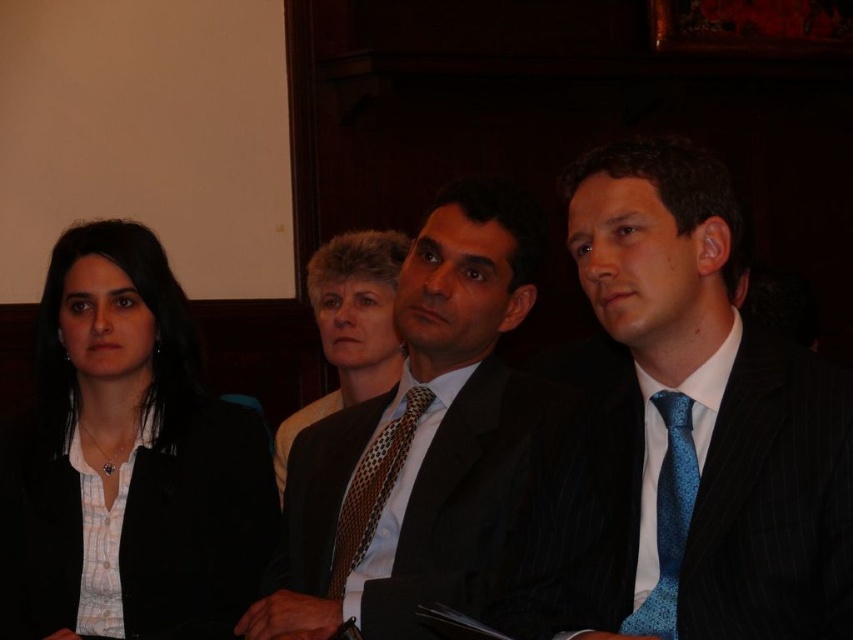
You are standing in the room and want to place a small plant exactly at the point marked in the image. The point is at coordinates (697, 426). Which object in the image is closest to this point?

The blue silk tie at center is located at point (697, 426), so the closest object to this point is the blue silk tie at center.

You are standing in the room and want to place a new decorative item at point (126, 461). What object is currently at that location?

The matte black jacket at left is at point (126, 461).

You are a photographer setting up for a group portrait. You need to adjust the camera focus so that both the matte black jacket at left and the brown dotted tie at center are in sharp focus. Given that your camera has a depth of field that can cover objects within a 20 inch range, will you be able to capture both items clearly without adjusting the focus distance?

The matte black jacket at left is 21.93 inches away from the brown dotted tie at center. Since the distance between them exceeds the camera sensor depth of field range of 20 inches, the photographer will need to adjust the focus distance to ensure both are in focus.